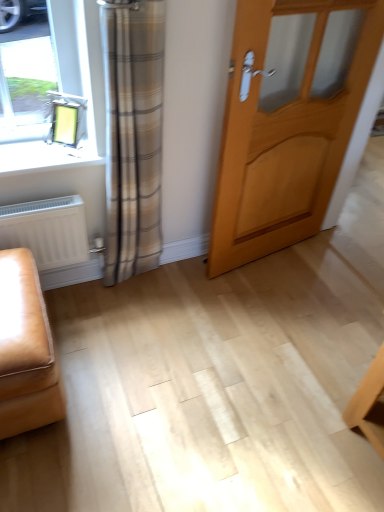
Question: Does leather ottoman at lower left turn towards white matte radiator at lower left?

Choices:
 (A) yes
 (B) no

Answer: (B)

Question: Considering the relative positions of leather ottoman at lower left and white matte radiator at lower left in the image provided, is leather ottoman at lower left to the right of white matte radiator at lower left from the viewer's perspective?

Choices:
 (A) yes
 (B) no

Answer: (B)

Question: From the image's perspective, is leather ottoman at lower left located beneath white matte radiator at lower left?

Choices:
 (A) no
 (B) yes

Answer: (B)

Question: Does leather ottoman at lower left lie in front of white matte radiator at lower left?

Choices:
 (A) no
 (B) yes

Answer: (B)

Question: Can you confirm if leather ottoman at lower left is positioned to the left of white matte radiator at lower left?

Choices:
 (A) no
 (B) yes

Answer: (B)

Question: Is leather ottoman at lower left far from white matte radiator at lower left?

Choices:
 (A) yes
 (B) no

Answer: (B)

Question: Is leather ottoman at lower left located outside light wood door at center?

Choices:
 (A) yes
 (B) no

Answer: (A)

Question: From the image's perspective, is leather ottoman at lower left over light wood door at center?

Choices:
 (A) yes
 (B) no

Answer: (B)

Question: Considering the relative positions of leather ottoman at lower left and light wood door at center in the image provided, is leather ottoman at lower left in front of light wood door at center?

Choices:
 (A) no
 (B) yes

Answer: (B)

Question: Is leather ottoman at lower left far from light wood door at center?

Choices:
 (A) no
 (B) yes

Answer: (B)

Question: Considering the relative sizes of leather ottoman at lower left and light wood door at center in the image provided, is leather ottoman at lower left taller than light wood door at center?

Choices:
 (A) yes
 (B) no

Answer: (B)

Question: Is leather ottoman at lower left facing towards light wood door at center?

Choices:
 (A) yes
 (B) no

Answer: (B)

Question: Does light wood door at center have a greater width compared to white matte radiator at lower left?

Choices:
 (A) no
 (B) yes

Answer: (A)